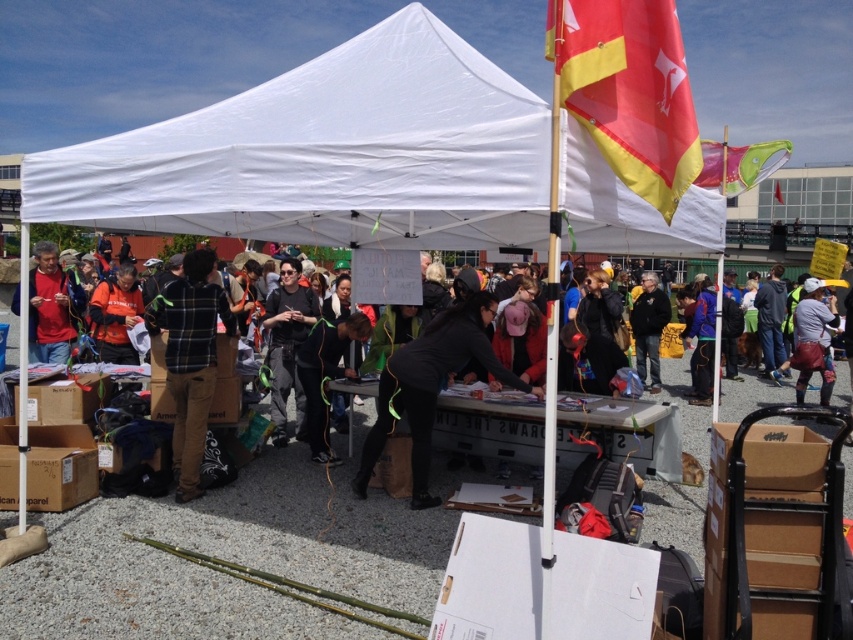
You are standing at the entrance of the outdoor event and want to walk to the point marked at coordinates point (189, 371) and point (824, 396). Which point should you reach first if you are moving towards them?

You should reach point (189, 371) first because it is closer to you than point (824, 396).

You are at the outdoor event and see the plaid fabric shirt at center and the leather bag at right. Which item is positioned closer to the left side of the scene?

The plaid fabric shirt at center is positioned to the left of the leather bag at right, so it is closer to the left side of the scene.